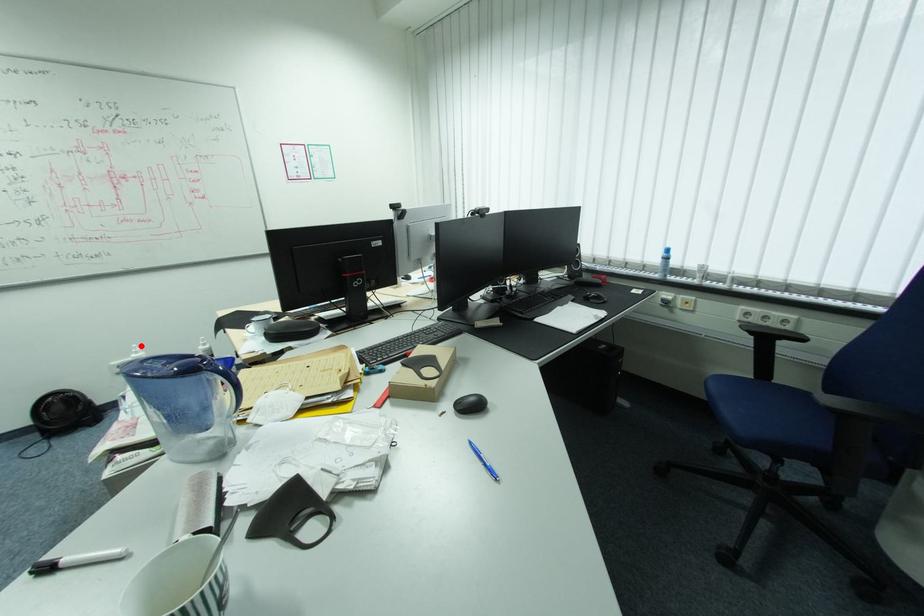
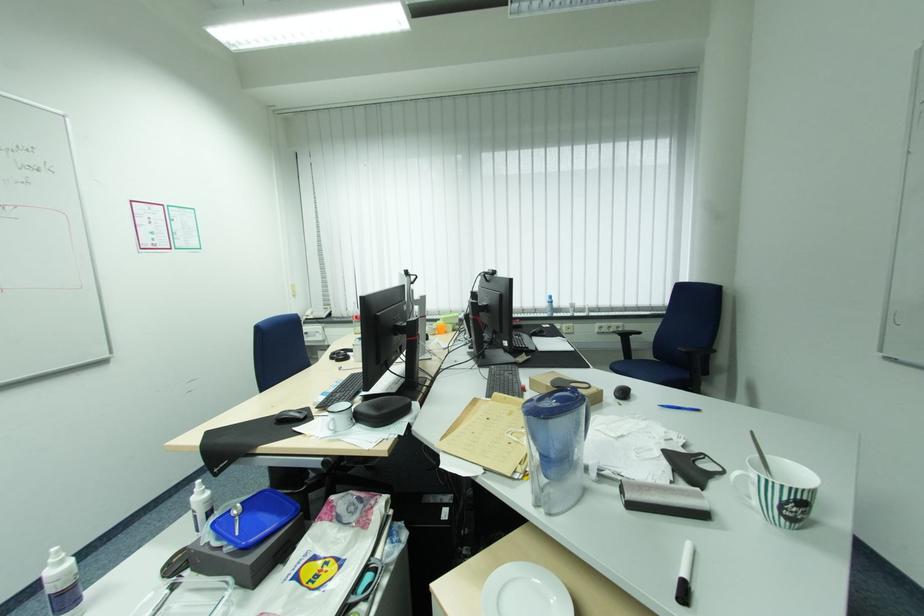
Question: I am providing you with two images of the same scene from different viewpoints. Image1 has a red point marked. In image2, the corresponding 3D location appears at what relative position? Reply with the corresponding letter.

Choices:
 (A) Closer
 (B) Farther

Answer: (A)